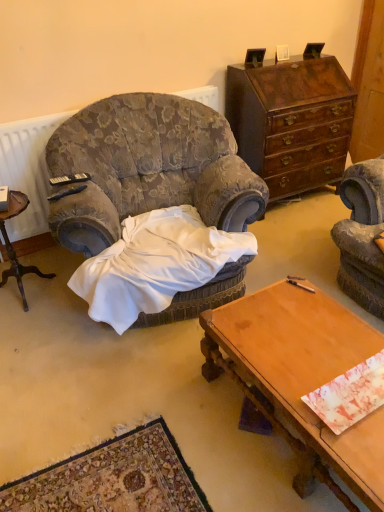
Find the location of a particular element. free region under marbled paper at center (from a real-world perspective) is located at coordinates (353, 393).